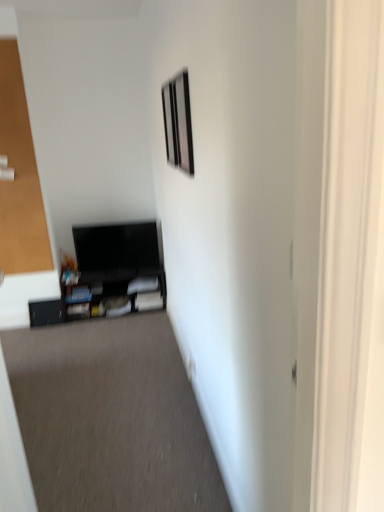
Question: Does metallic silver picture frame at upper center, marked as the 2th picture frame in a left-to-right arrangement, have a lesser width compared to transparent glass door at left?

Choices:
 (A) yes
 (B) no

Answer: (A)

Question: Would you say transparent glass door at left is part of metallic silver picture frame at upper center, which is counted as the first picture frame, starting from the right,'s contents?

Choices:
 (A) no
 (B) yes

Answer: (A)

Question: From the image's perspective, is metallic silver picture frame at upper center, which ranks as the 1th picture frame in front-to-back order, on transparent glass door at left?

Choices:
 (A) yes
 (B) no

Answer: (B)

Question: From the image's perspective, does metallic silver picture frame at upper center, which ranks as the 1th picture frame in front-to-back order, appear lower than transparent glass door at left?

Choices:
 (A) no
 (B) yes

Answer: (B)

Question: From a real-world perspective, is metallic silver picture frame at upper center, which is counted as the first picture frame, starting from the right, on transparent glass door at left?

Choices:
 (A) no
 (B) yes

Answer: (B)

Question: Which is correct: matte black picture frame at upper center, the 1th picture frame from the back, is inside matte black entertainment center at lower left, or outside of it?

Choices:
 (A) inside
 (B) outside

Answer: (B)

Question: From the image's perspective, relative to matte black entertainment center at lower left, is matte black picture frame at upper center, the 1th picture frame from the back, above or below?

Choices:
 (A) above
 (B) below

Answer: (A)

Question: Looking at their shapes, would you say matte black picture frame at upper center, which is the second picture frame in front-to-back order, is wider or thinner than matte black entertainment center at lower left?

Choices:
 (A) thin
 (B) wide

Answer: (A)

Question: From their relative heights in the image, would you say matte black picture frame at upper center, which is the second picture frame in front-to-back order, is taller or shorter than matte black entertainment center at lower left?

Choices:
 (A) tall
 (B) short

Answer: (A)

Question: Is point (79, 252) positioned closer to the camera than point (102, 386)?

Choices:
 (A) closer
 (B) farther

Answer: (B)

Question: Is matte black entertainment center at lower left in front of or behind black cardboard box at lower left in the image?

Choices:
 (A) front
 (B) behind

Answer: (B)

Question: Would you say matte black entertainment center at lower left is to the left or to the right of black cardboard box at lower left in the picture?

Choices:
 (A) left
 (B) right

Answer: (B)

Question: From a real-world perspective, is matte black entertainment center at lower left positioned above or below black cardboard box at lower left?

Choices:
 (A) below
 (B) above

Answer: (B)

Question: Looking at their shapes, would you say transparent glass door at left is wider or thinner than black cardboard box at lower left?

Choices:
 (A) wide
 (B) thin

Answer: (B)

Question: Is transparent glass door at left taller or shorter than black cardboard box at lower left?

Choices:
 (A) short
 (B) tall

Answer: (B)